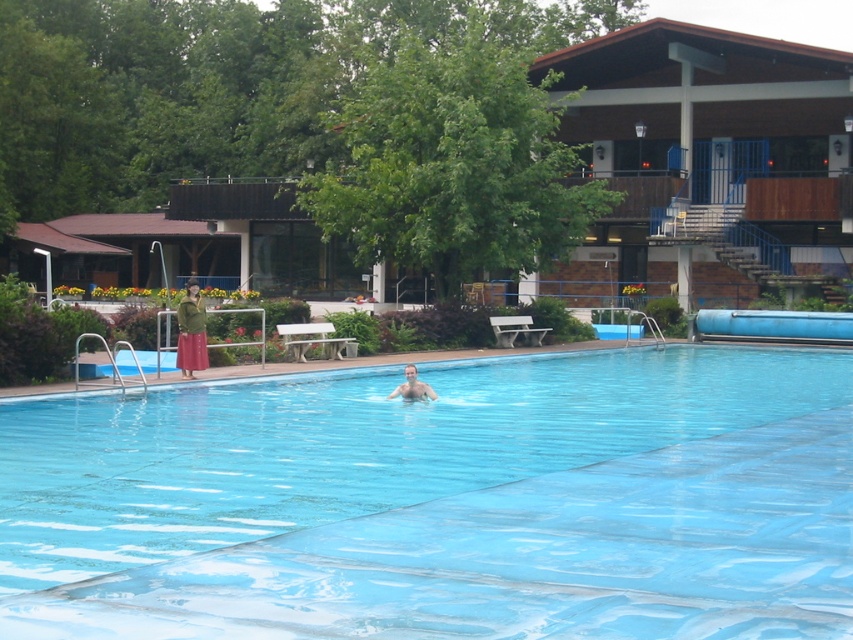
Is point (190, 371) positioned in front of point (418, 385)?

No, (190, 371) is behind (418, 385).

The width and height of the screenshot is (853, 640). I want to click on green textured dress at left, so click(x=190, y=332).

Looking at this image, between transparent plastic pool at center and smooth skin person at center, which one appears on the left side from the viewer's perspective?

From the viewer's perspective, smooth skin person at center appears more on the left side.

Does transparent plastic pool at center have a greater width compared to smooth skin person at center?

Yes, transparent plastic pool at center is wider than smooth skin person at center.

The height and width of the screenshot is (640, 853). In order to click on transparent plastic pool at center in this screenshot , I will do `click(451, 504)`.

Does transparent plastic pool at center appear on the left side of green textured dress at left?

Incorrect, transparent plastic pool at center is not on the left side of green textured dress at left.

At what (x,y) coordinates should I click in order to perform the action: click on transparent plastic pool at center. Please return your answer as a coordinate pair (x, y). Looking at the image, I should click on (451, 504).